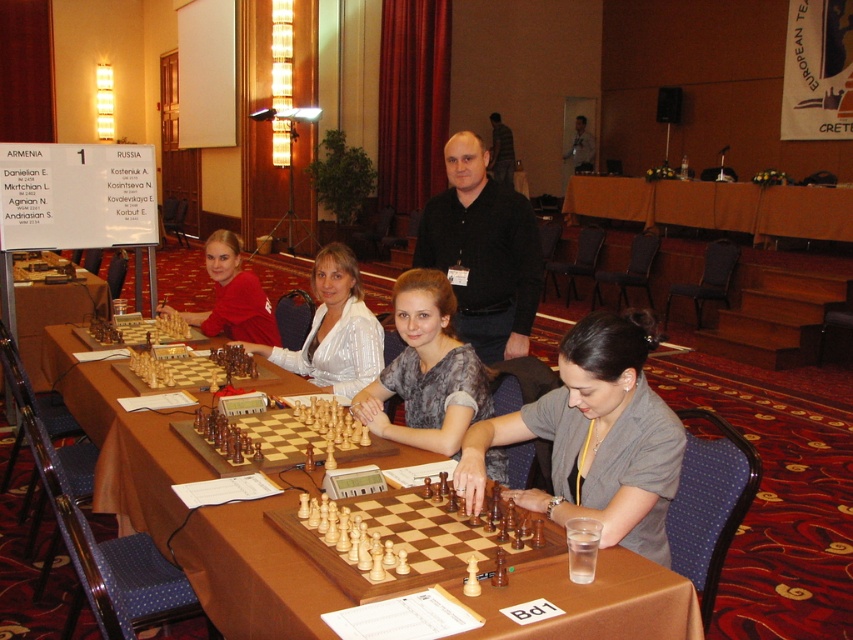
Where is `brown wooden table at center`? This screenshot has width=853, height=640. brown wooden table at center is located at coordinates (254, 573).

Is brown wooden table at center shorter than wooden chess set at center?

No.

Which is in front, point (161, 506) or point (233, 369)?

Point (161, 506)

This screenshot has height=640, width=853. What are the coordinates of `brown wooden table at center` in the screenshot? It's located at (254, 573).

Locate an element on the screen. The image size is (853, 640). brown wooden table at center is located at coordinates (254, 573).

Can you confirm if brown wooden table at center is positioned below black shirt at center?

Indeed, brown wooden table at center is positioned under black shirt at center.

Where is `brown wooden table at center`? brown wooden table at center is located at coordinates (254, 573).

Is point (416, 344) behind point (769, 227)?

No, it is not.

The image size is (853, 640). What do you see at coordinates (427, 371) in the screenshot?
I see `gray textured blouse at center` at bounding box center [427, 371].

Find the location of a particular element. gray textured blouse at center is located at coordinates (427, 371).